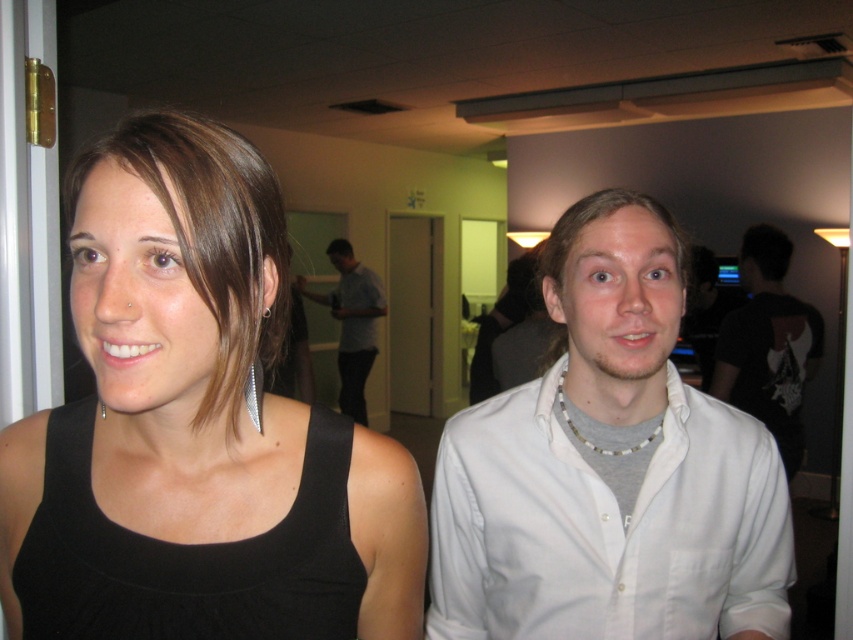
Which is in front, point (212, 259) or point (734, 317)?

Point (212, 259) is more forward.

The width and height of the screenshot is (853, 640). I want to click on black fabric tank top at left, so click(x=183, y=330).

Which is behind, point (645, 538) or point (265, 310)?

The point (645, 538) is behind.

Looking at this image, does white cotton shirt at right appear under silver metallic earring at left ear?

Yes.

Is point (576, 483) positioned in front of point (268, 314)?

No, (576, 483) is further to viewer.

This screenshot has height=640, width=853. Find the location of `white cotton shirt at right`. white cotton shirt at right is located at coordinates (607, 525).

Consider the image. Is black fabric tank top at left behind white cotton shirt at right?

That is False.

Is point (74, 260) farther from camera compared to point (524, 416)?

No, it is not.

Identify the location of black fabric tank top at left. The image size is (853, 640). (183, 330).